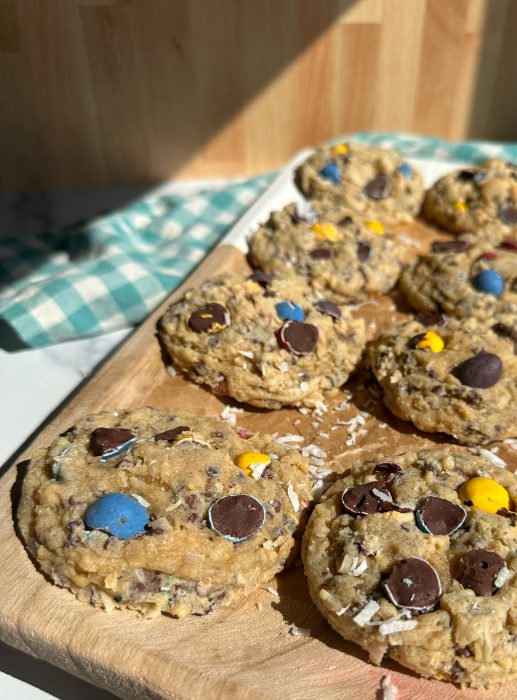
I want to click on brown wood wall, so click(x=214, y=43).